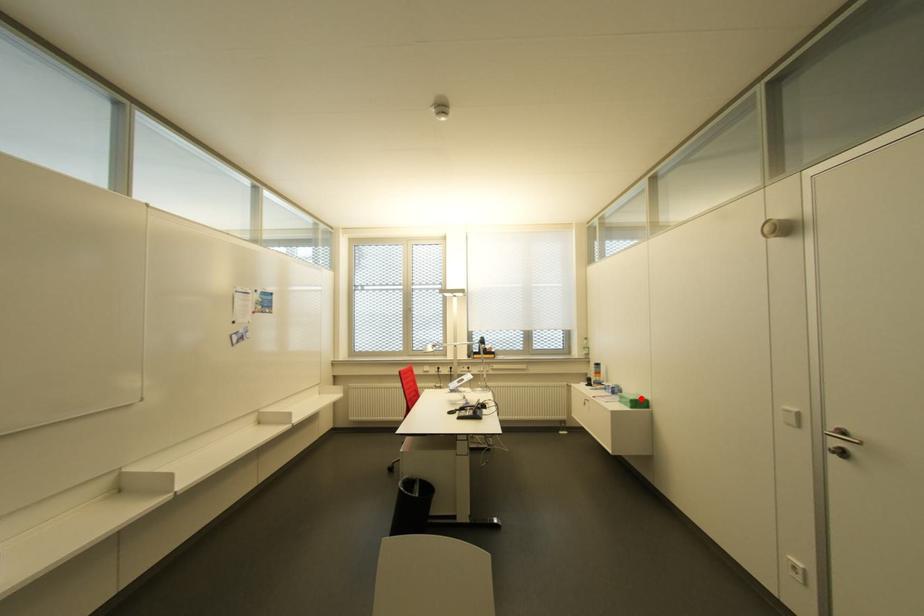
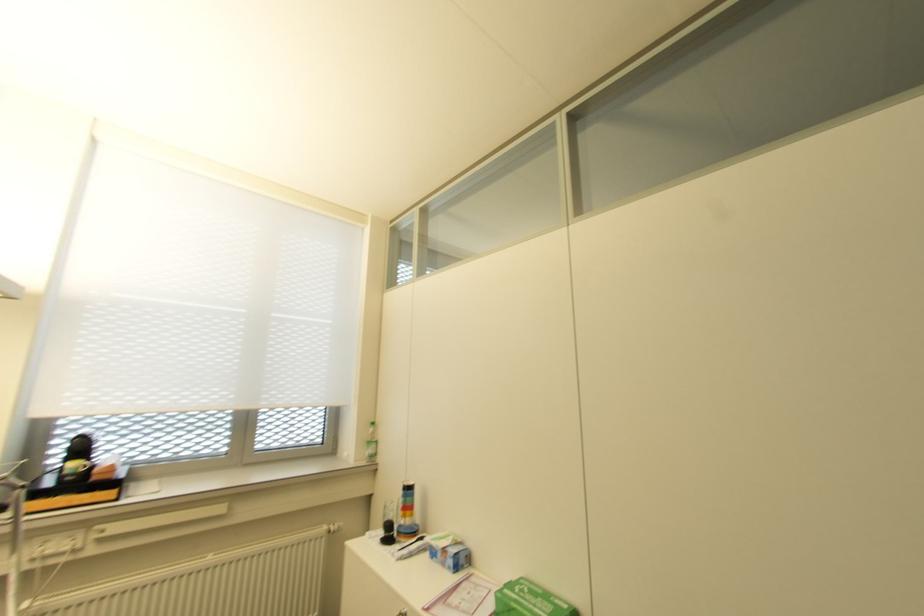
Where in the second image is the point corresponding to the highlighted location from the first image?

(563, 605)